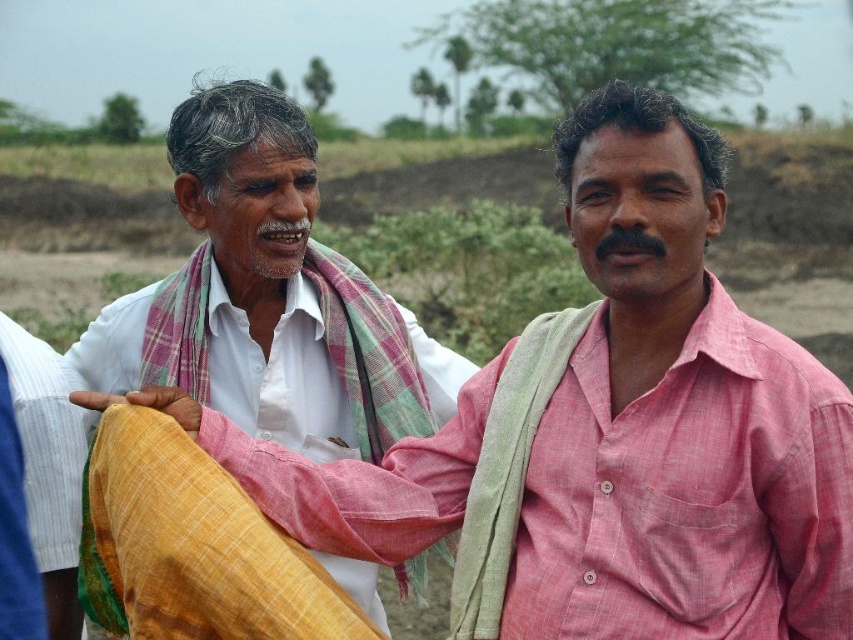
From the picture: Is white cotton shirt at left behind yellow woven cloth at center?

Yes, it is behind yellow woven cloth at center.

Is white cotton shirt at left positioned in front of yellow woven cloth at center?

No.

Is point (337, 292) less distant than point (219, 538)?

No, (337, 292) is further to viewer.

Locate an element on the screen. The image size is (853, 640). white cotton shirt at left is located at coordinates (x=270, y=298).